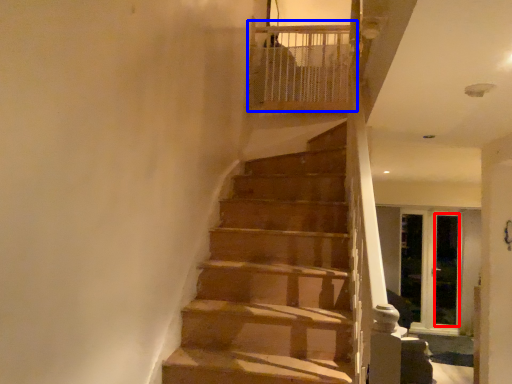
Question: Which of the following is the closest to the observer, screen door (highlighted by a red box) or balustrade (highlighted by a blue box)?

Choices:
 (A) screen door
 (B) balustrade

Answer: (B)